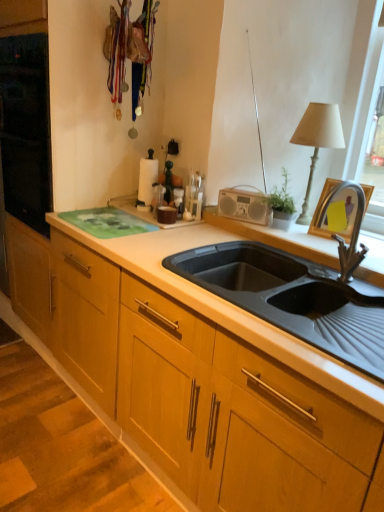
What is the approximate width of black rubber sink at center?

The width of black rubber sink at center is 22.45 inches.

What do you see at coordinates (147, 179) in the screenshot? I see `white paper towel holder at upper center` at bounding box center [147, 179].

Where is `white fabric lampshade at upper right`? Image resolution: width=384 pixels, height=512 pixels. white fabric lampshade at upper right is located at coordinates (317, 140).

Which is correct: white fabric lampshade at upper right is inside white paper towel holder at upper center, or outside of it?

white fabric lampshade at upper right lies outside white paper towel holder at upper center.

Which object is thinner, white fabric lampshade at upper right or white paper towel holder at upper center?

white paper towel holder at upper center is thinner.

From a real-world perspective, is white fabric lampshade at upper right located higher than white paper towel holder at upper center?

Correct, in the physical world, white fabric lampshade at upper right is higher than white paper towel holder at upper center.

From the image's perspective, is white fabric lampshade at upper right above white paper towel holder at upper center?

Yes, from the image's perspective, white fabric lampshade at upper right is on top of white paper towel holder at upper center.

Is black rubber sink at center taller than white paper towel holder at upper center?

No.

Is black rubber sink at center positioned far away from white paper towel holder at upper center?

That's not correct — black rubber sink at center is a little close to white paper towel holder at upper center.

Is the depth of black rubber sink at center greater than that of white paper towel holder at upper center?

No, black rubber sink at center is closer to the viewer.

The image size is (384, 512). What are the coordinates of `window sill on the right side of white paper towel holder at upper center` in the screenshot? It's located at (280, 238).

Does point (323, 255) lie behind point (307, 204)?

That is False.

The width and height of the screenshot is (384, 512). I want to click on window sill below the white fabric lampshade at upper right (from a real-world perspective), so click(280, 238).

Is black rubber sink at center far from white fabric lampshade at upper right?

They are positioned close to each other.

Between black rubber sink at center and white fabric lampshade at upper right, which one appears on the right side from the viewer's perspective?

white fabric lampshade at upper right is more to the right.

Can black rubber sink at center be found inside white fabric lampshade at upper right?

Definitely not — black rubber sink at center is not inside white fabric lampshade at upper right.

Visually, is white fabric lampshade at upper right positioned to the left or to the right of black rubber sink at center?

white fabric lampshade at upper right is to the right of black rubber sink at center.

Is white fabric lampshade at upper right with black rubber sink at center?

There is a gap between white fabric lampshade at upper right and black rubber sink at center.

Between point (143, 199) and point (261, 230), which one is positioned behind?

The point (143, 199) is farther from the camera.

In the image, is white paper towel holder at upper center on the left side or the right side of black rubber sink at center?

white paper towel holder at upper center is positioned on black rubber sink at center's left side.

Considering the relative sizes of white paper towel holder at upper center and black rubber sink at center in the image provided, is white paper towel holder at upper center thinner than black rubber sink at center?

Correct, the width of white paper towel holder at upper center is less than that of black rubber sink at center.

From a real-world perspective, is white paper towel holder at upper center positioned above or below white fabric lampshade at upper right?

Clearly, from a real-world perspective, white paper towel holder at upper center is below white fabric lampshade at upper right.

Looking at this image, from the image's perspective, is white paper towel holder at upper center positioned above or below white fabric lampshade at upper right?

Based on their image positions, white paper towel holder at upper center is located beneath white fabric lampshade at upper right.

Can you tell me how much white paper towel holder at upper center and white fabric lampshade at upper right differ in facing direction?

They differ by 3.46 degrees in their facing directions.

Which of these two, white paper towel holder at upper center or white fabric lampshade at upper right, is smaller?

white paper towel holder at upper center is smaller.

I want to click on table lamp on the right of white paper towel holder at upper center, so click(x=317, y=140).

You are a GUI agent. You are given a task and a screenshot of the screen. Output one action in this format:
    pyautogui.click(x=<x>, y=<y>)
    Task: Click on the appliance located above the black rubber sink at center (from the image's perspective)
    
    Given the screenshot: What is the action you would take?
    pyautogui.click(x=147, y=179)

Looking at the image, which one is located closer to white fabric lampshade at upper right, black rubber sink at center or white paper towel holder at upper center?

black rubber sink at center is closer to white fabric lampshade at upper right.

Based on their spatial positions, is white fabric lampshade at upper right or white paper towel holder at upper center further from black rubber sink at center?

white paper towel holder at upper center.

When comparing their distances from black rubber sink at center, does white paper towel holder at upper center or white fabric lampshade at upper right seem closer?

The object closer to black rubber sink at center is white fabric lampshade at upper right.

Looking at the image, which one is located further to white paper towel holder at upper center, black rubber sink at center or white fabric lampshade at upper right?

Among the two, white fabric lampshade at upper right is located further to white paper towel holder at upper center.

Considering their positions, is white paper towel holder at upper center positioned further to white fabric lampshade at upper right than black rubber sink at center?

white paper towel holder at upper center is positioned further to the anchor white fabric lampshade at upper right.

Looking at the image, which one is located closer to white paper towel holder at upper center, white fabric lampshade at upper right or black rubber sink at center?

black rubber sink at center.

Image resolution: width=384 pixels, height=512 pixels. I want to click on window sill between white paper towel holder at upper center and white fabric lampshade at upper right in the horizontal direction, so click(280, 238).